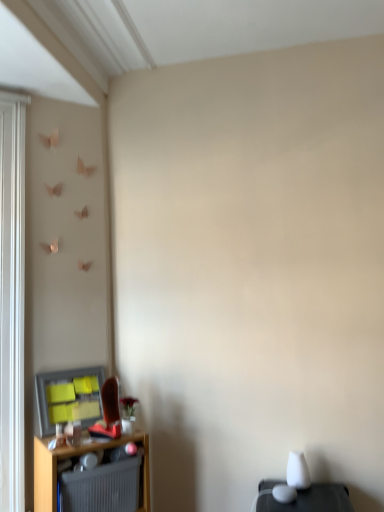
Question: Does matte plastic window screen at lower left have a greater height compared to gray ribbed radiator at lower left?

Choices:
 (A) yes
 (B) no

Answer: (A)

Question: From a real-world perspective, is matte plastic window screen at lower left located beneath gray ribbed radiator at lower left?

Choices:
 (A) no
 (B) yes

Answer: (A)

Question: Is matte plastic window screen at lower left closer to the viewer compared to gray ribbed radiator at lower left?

Choices:
 (A) yes
 (B) no

Answer: (B)

Question: Can you confirm if matte plastic window screen at lower left is bigger than gray ribbed radiator at lower left?

Choices:
 (A) yes
 (B) no

Answer: (B)

Question: Is matte plastic window screen at lower left thinner than gray ribbed radiator at lower left?

Choices:
 (A) no
 (B) yes

Answer: (B)

Question: From a real-world perspective, relative to wooden shelf at lower left, is gray ribbed radiator at lower left vertically above or below?

Choices:
 (A) above
 (B) below

Answer: (A)

Question: Considering the positions of point (115, 480) and point (52, 505), is point (115, 480) closer or farther from the camera than point (52, 505)?

Choices:
 (A) farther
 (B) closer

Answer: (B)

Question: Based on their positions, is gray ribbed radiator at lower left located to the left or right of wooden shelf at lower left?

Choices:
 (A) left
 (B) right

Answer: (B)

Question: In terms of height, does gray ribbed radiator at lower left look taller or shorter compared to wooden shelf at lower left?

Choices:
 (A) tall
 (B) short

Answer: (B)

Question: From the image's perspective, is gray ribbed radiator at lower left located above or below matte plastic window screen at lower left?

Choices:
 (A) above
 (B) below

Answer: (B)

Question: Looking at their shapes, would you say gray ribbed radiator at lower left is wider or thinner than matte plastic window screen at lower left?

Choices:
 (A) thin
 (B) wide

Answer: (B)

Question: In the image, is gray ribbed radiator at lower left positioned in front of or behind matte plastic window screen at lower left?

Choices:
 (A) front
 (B) behind

Answer: (A)

Question: Is point (64, 495) closer or farther from the camera than point (51, 413)?

Choices:
 (A) farther
 (B) closer

Answer: (B)

Question: Is point (96, 408) positioned closer to the camera than point (84, 500)?

Choices:
 (A) closer
 (B) farther

Answer: (B)

Question: From the image's perspective, is matte plastic window screen at lower left located above or below gray ribbed radiator at lower left?

Choices:
 (A) below
 (B) above

Answer: (B)